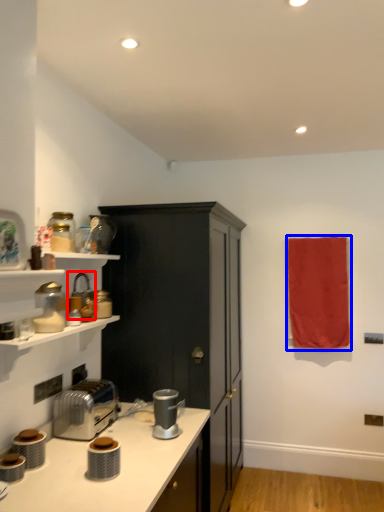
Question: Which object appears closest to the camera in this image, appliance (highlighted by a red box) or beach towel (highlighted by a blue box)?

Choices:
 (A) appliance
 (B) beach towel

Answer: (A)